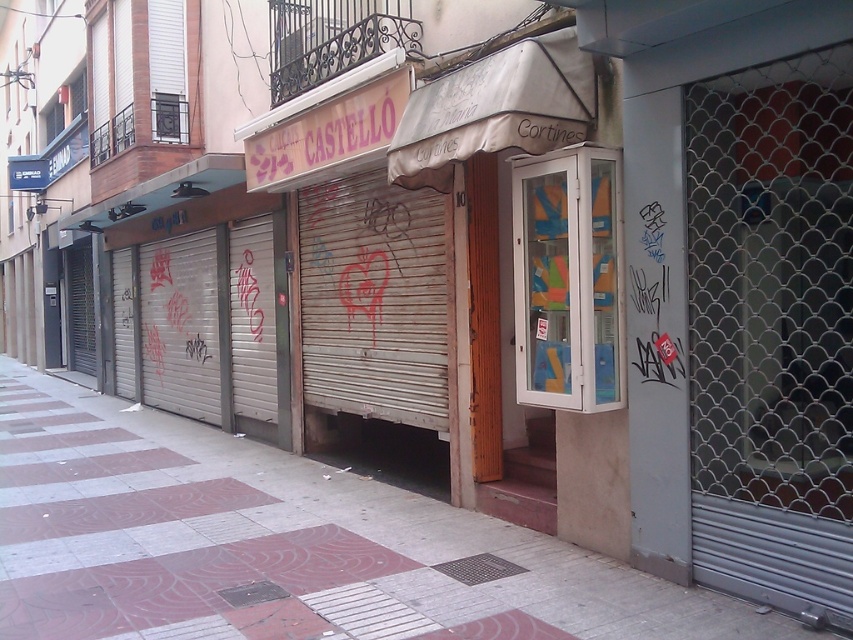
Identify the location of smooth concrete pavement at center. The width and height of the screenshot is (853, 640). (281, 545).

Between metallic silver garage door at left and clear glass cabinet at center, which one has less height?

clear glass cabinet at center

Is metallic silver garage door at left to the right of clear glass cabinet at center from the viewer's perspective?

No, metallic silver garage door at left is not to the right of clear glass cabinet at center.

You are a GUI agent. You are given a task and a screenshot of the screen. Output one action in this format:
    pyautogui.click(x=<x>, y=<y>)
    Task: Click on the metallic silver garage door at left
    This screenshot has height=640, width=853.
    Given the screenshot: What is the action you would take?
    pyautogui.click(x=218, y=326)

Does smooth concrete pavement at center have a greater height compared to clear glass cabinet at center?

In fact, smooth concrete pavement at center may be shorter than clear glass cabinet at center.

What are the coordinates of `smooth concrete pavement at center` in the screenshot? It's located at (281, 545).

Identify the location of smooth concrete pavement at center. This screenshot has width=853, height=640. (281, 545).

Where is `smooth concrete pavement at center`? smooth concrete pavement at center is located at coordinates (281, 545).